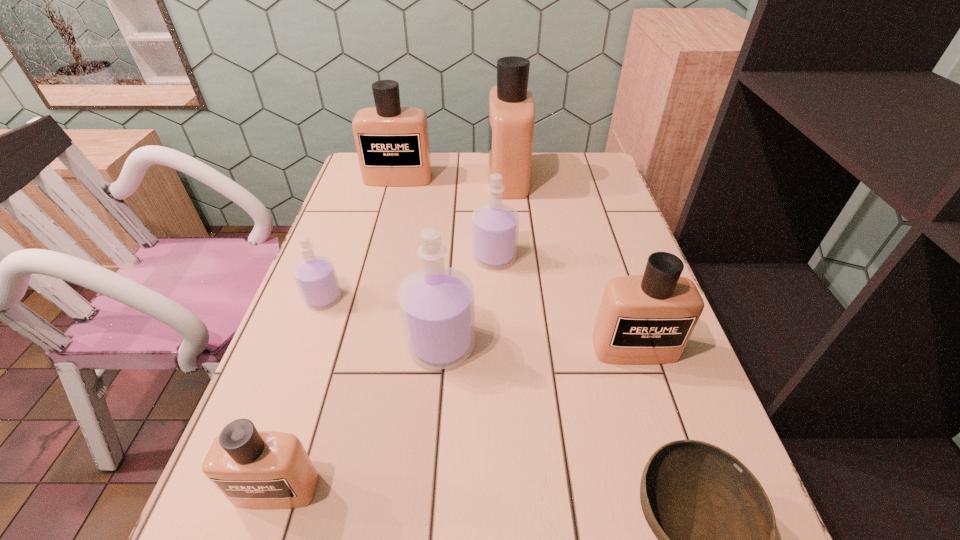
Find the location of a particular element. the smallest beige perfume is located at coordinates (253, 469).

I want to click on the nearest perfume, so click(253, 469).

Locate an element on the screen. This screenshot has height=540, width=960. vacant region located 0.110m on the front label of the third beige perfume from left to right is located at coordinates (454, 178).

Identify the location of vacant space located on the front label of the third beige perfume from left to right. The width and height of the screenshot is (960, 540). 372,178.

Identify the location of free space located 0.090m on the front label of the third beige perfume from left to right. (460, 178).

What are the coordinates of `vacant area situated 0.330m on the front label of the second biggest beige perfume` in the screenshot? It's located at (378, 254).

This screenshot has height=540, width=960. I want to click on free spot located 0.080m on the right of the nearest purple perfume, so click(x=513, y=345).

At what (x,y) coordinates should I click in order to perform the action: click on free spot located 0.210m on the front of the farthest purple perfume. Please return your answer as a coordinate pair (x, y). Looking at the image, I should click on (497, 337).

Where is `vacant space located 0.150m on the front label of the rightmost beige perfume`? vacant space located 0.150m on the front label of the rightmost beige perfume is located at coordinates (662, 435).

Locate an element on the screen. The width and height of the screenshot is (960, 540). vacant space located on the right of the fourth farthest perfume is located at coordinates (380, 298).